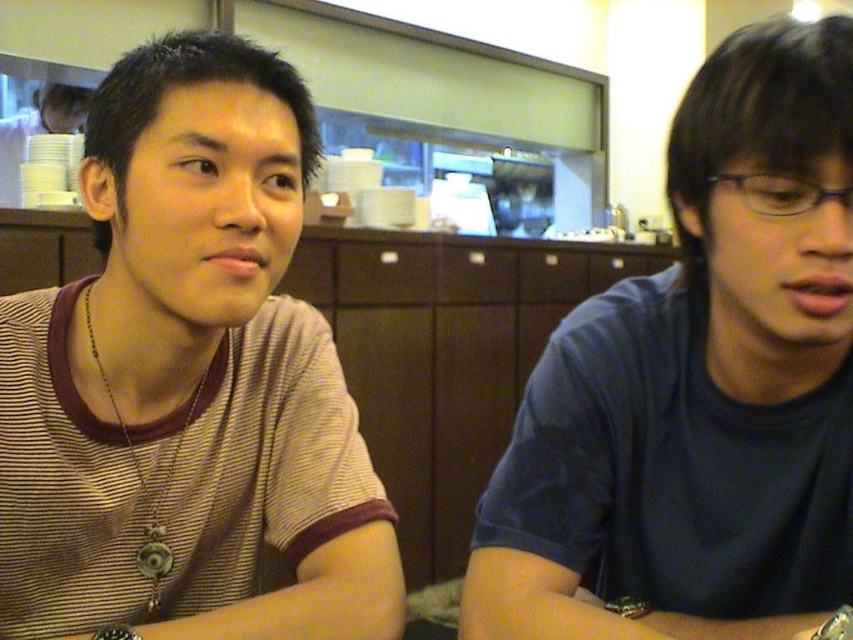
You are a photographer setting up a shoot in this dining area. You want to ensure both the brown striped shirt at left and the blue matte shirt at right are clearly visible in the photo. Given their positions, which shirt should you focus on to ensure both are in focus?

The blue matte shirt at right is behind the brown striped shirt at left. To ensure both are in focus, you should focus on the brown striped shirt at left since it is closer to the camera, and the depth of field may extend to include the background subject as well.

You are a photographer setting up for a portrait session. You need to position a spotlight to the left of the brown striped shirt at left and to the right of the blue matte shirt at right. Is this possible given their positions?

The brown striped shirt at left is already positioned to the left of the blue matte shirt at right. Therefore, placing the spotlight to the left of the brown striped shirt at left and to the right of the blue matte shirt at right would require the spotlight to be in two opposite locations simultaneously, which is not possible.

You are standing at the center of the room and see two points marked on the wall. The first point is at coordinate point (149,228) and the second is at point (798,552). Which point is closer to you?

Point (149,228) is in front of point (798,552), so the first point is closer to you.